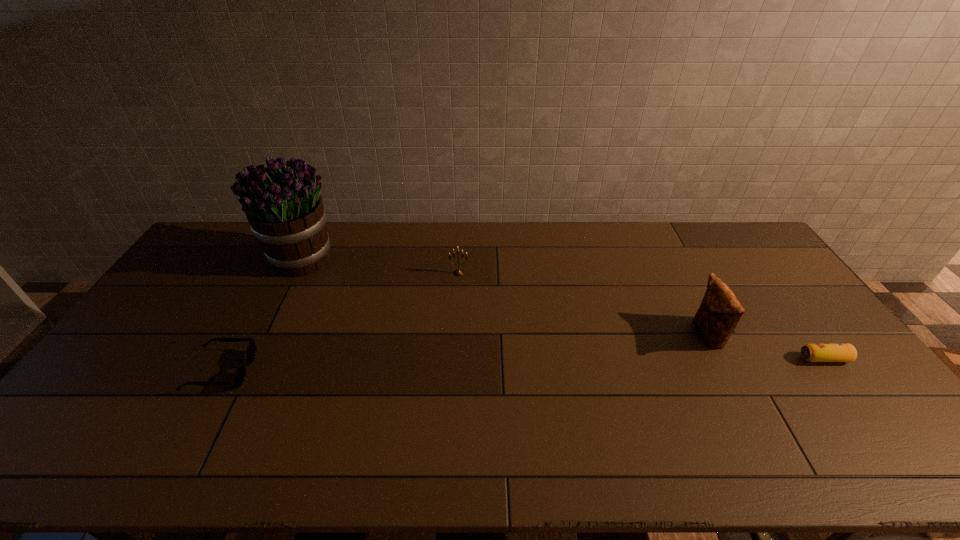
Locate an element on the screen. This screenshot has height=540, width=960. vacant space at the far right corner of the desktop is located at coordinates [x=735, y=230].

Where is `free spot between the beer can and the candelabrum`? Image resolution: width=960 pixels, height=540 pixels. free spot between the beer can and the candelabrum is located at coordinates (641, 316).

This screenshot has width=960, height=540. I want to click on empty space that is in between the third object from right to left and the tallest object, so click(x=381, y=266).

The width and height of the screenshot is (960, 540). What are the coordinates of `unoccupied position between the bouquet and the third shortest object` in the screenshot? It's located at (381, 266).

You are a GUI agent. You are given a task and a screenshot of the screen. Output one action in this format:
    pyautogui.click(x=<x>, y=<y>)
    Task: Click on the vacant space in between the sunglasses and the bouquet
    The image size is (960, 540).
    Given the screenshot: What is the action you would take?
    pyautogui.click(x=262, y=314)

You are a GUI agent. You are given a task and a screenshot of the screen. Output one action in this format:
    pyautogui.click(x=<x>, y=<y>)
    Task: Click on the vacant area that lies between the bouquet and the fourth object from left to right
    
    Given the screenshot: What is the action you would take?
    pyautogui.click(x=505, y=296)

Where is `free space between the clutch bag and the rightmost object`? The height and width of the screenshot is (540, 960). free space between the clutch bag and the rightmost object is located at coordinates (765, 347).

Locate an element on the screen. This screenshot has width=960, height=540. vacant region between the bouquet and the sunglasses is located at coordinates (262, 314).

Where is `free space between the sunglasses and the third object from right to left`? This screenshot has height=540, width=960. free space between the sunglasses and the third object from right to left is located at coordinates (340, 322).

Image resolution: width=960 pixels, height=540 pixels. I want to click on vacant area that lies between the beer can and the second tallest object, so click(x=765, y=347).